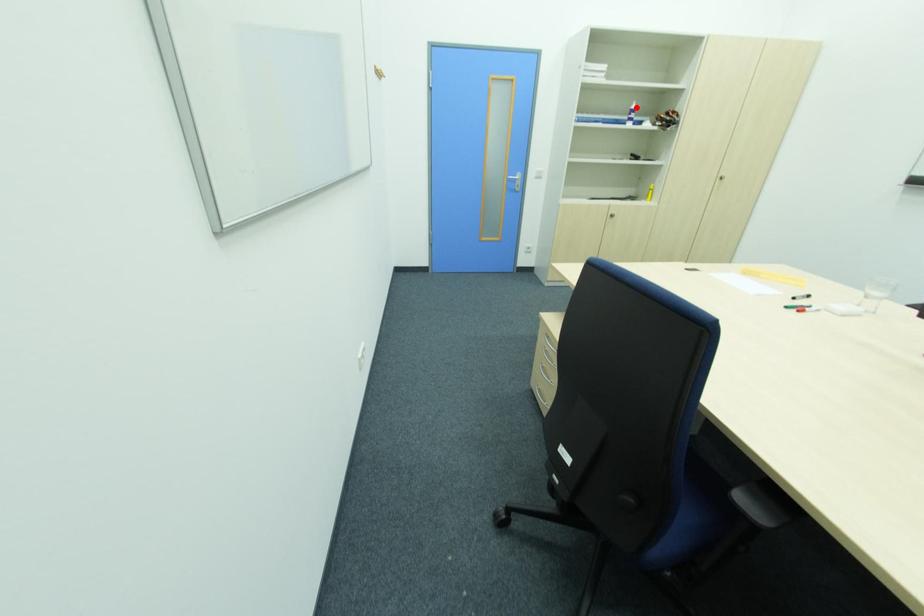
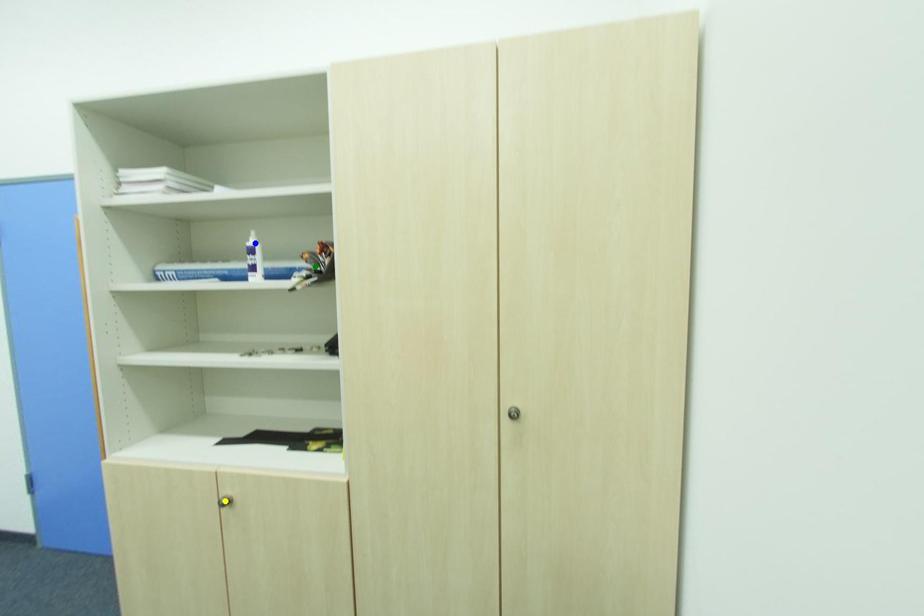
Question: I am providing you with two images of the same scene from different viewpoints. A red point is marked on the first image. You are given multiple points on the second image. Which point in image 2 is actually the same real-world point as the red point in image 1?

Choices:
 (A) blue point
 (B) yellow point
 (C) green point

Answer: (A)